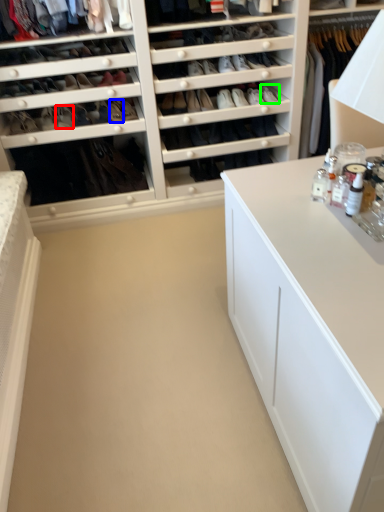
Question: Considering the real-world distances, which object is farthest from shoe (highlighted by a red box)? shoe (highlighted by a blue box) or shoe (highlighted by a green box)?

Choices:
 (A) shoe
 (B) shoe

Answer: (B)